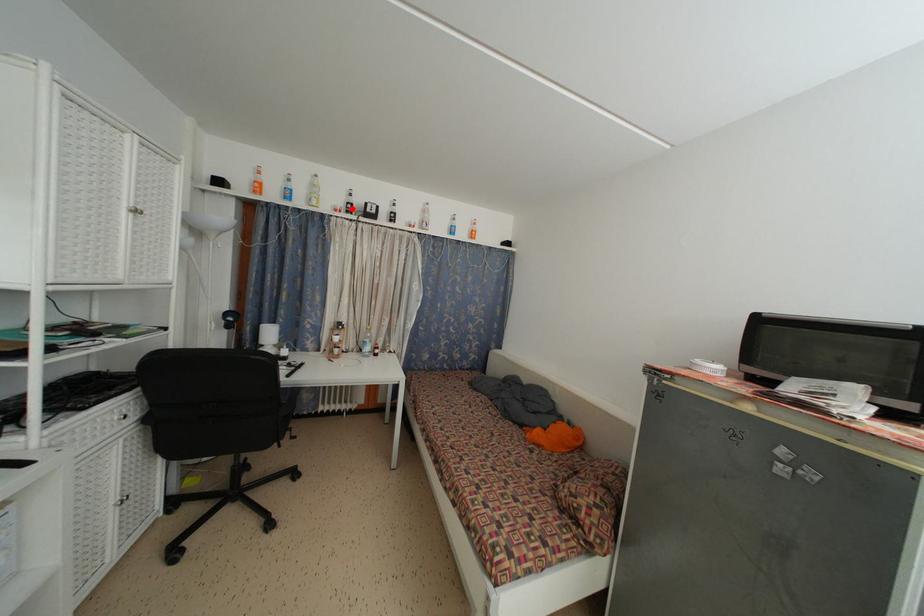
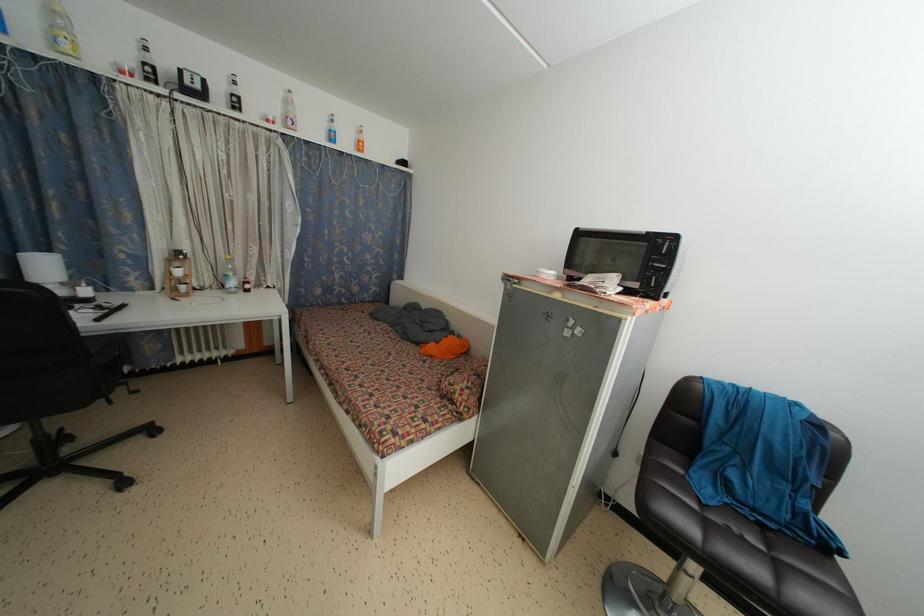
The point at the highlighted location is marked in the first image. Where is the corresponding point in the second image?

(149, 70)